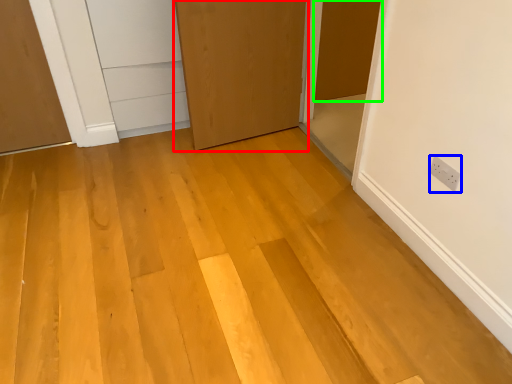
Question: Considering the real-world distances, which object is closest to door (highlighted by a red box)? electric outlet (highlighted by a blue box) or door (highlighted by a green box).

Choices:
 (A) electric outlet
 (B) door

Answer: (B)